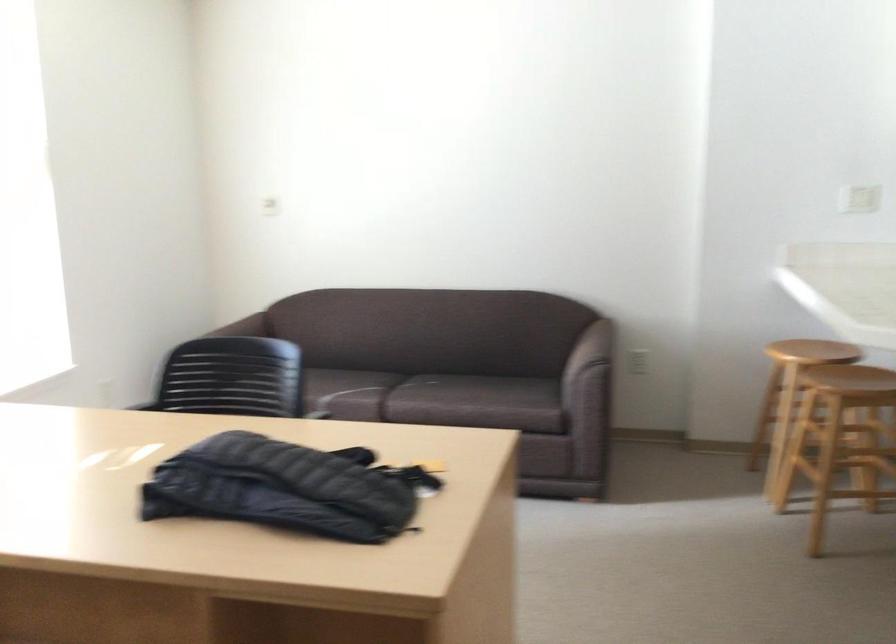
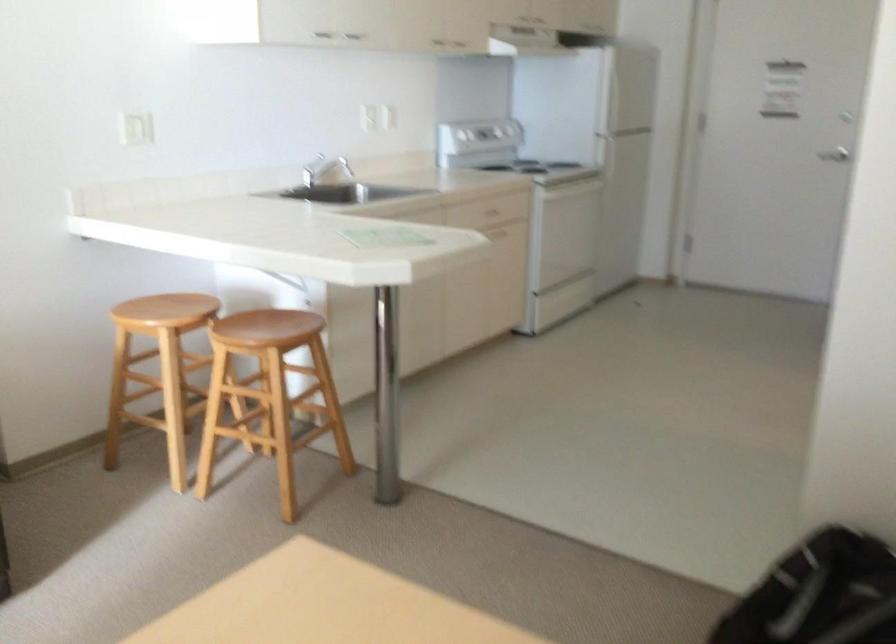
Find the pixel in the second image that matches pixel 815 345 in the first image.

(165, 310)